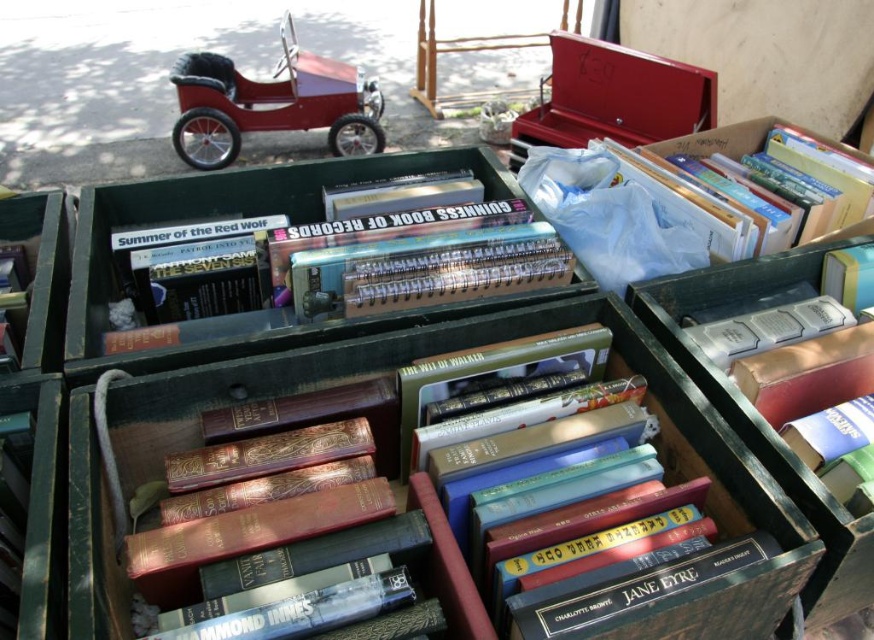
Question: From the image, what is the correct spatial relationship of shiny red toy car at upper left in relation to white plastic bag at upper right?

Choices:
 (A) left
 (B) right

Answer: (A)

Question: From the image, what is the correct spatial relationship of shiny red toy car at upper left in relation to white plastic bag at upper right?

Choices:
 (A) below
 (B) above

Answer: (B)

Question: Is shiny red toy car at upper left closer to camera compared to white plastic bag at upper right?

Choices:
 (A) yes
 (B) no

Answer: (B)

Question: Which point is farther to the camera?

Choices:
 (A) click(188, 109)
 (B) click(755, 252)

Answer: (A)